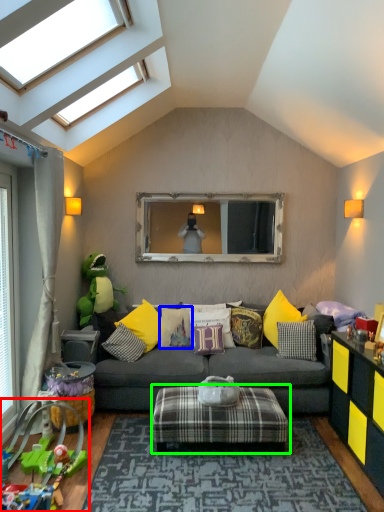
Question: Based on their relative distances, which object is farther from toy (highlighted by a red box)? Choose from pillow (highlighted by a blue box) and stool (highlighted by a green box).

Choices:
 (A) pillow
 (B) stool

Answer: (A)